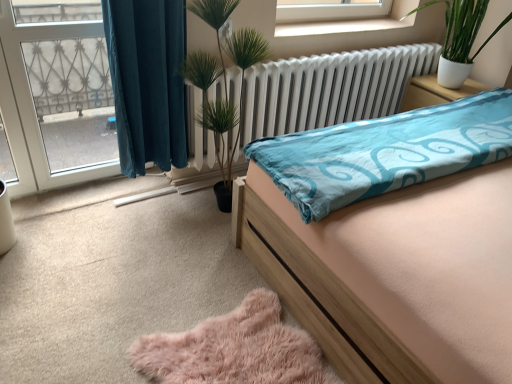
Measure the distance between wooden bed at center and camera.

The distance of wooden bed at center from camera is 3.36 feet.

The width and height of the screenshot is (512, 384). What do you see at coordinates (393, 246) in the screenshot? I see `wooden bed at center` at bounding box center [393, 246].

At what (x,y) coordinates should I click in order to perform the action: click on teal fabric curtain at left. Please return your answer as a coordinate pair (x, y). Looking at the image, I should click on (147, 81).

This screenshot has width=512, height=384. What do you see at coordinates (234, 349) in the screenshot?
I see `fluffy pink rug at lower center` at bounding box center [234, 349].

Image resolution: width=512 pixels, height=384 pixels. What do you see at coordinates (460, 38) in the screenshot?
I see `green glossy plant at upper right` at bounding box center [460, 38].

At what (x,y) coordinates should I click in order to perform the action: click on transparent glass door at left. Please return your answer as a coordinate pair (x, y). Image resolution: width=512 pixels, height=384 pixels. Looking at the image, I should click on (55, 93).

Where is `wooden bed at center`? Image resolution: width=512 pixels, height=384 pixels. wooden bed at center is located at coordinates (393, 246).

Considering the sizes of objects wooden bed at center and teal fabric curtain at left in the image provided, who is thinner, wooden bed at center or teal fabric curtain at left?

With smaller width is teal fabric curtain at left.

Which is more distant, (303, 157) or (146, 92)?

Positioned behind is point (146, 92).

Which is behind, wooden bed at center or teal fabric curtain at left?

Positioned behind is teal fabric curtain at left.

Who is bigger, wooden bed at center or teal fabric curtain at left?

Bigger between the two is wooden bed at center.

How distant is white glossy nightstand at upper right from transparent glass door at left?

A distance of 2.30 meters exists between white glossy nightstand at upper right and transparent glass door at left.

From a real-world perspective, which is physically below, white glossy nightstand at upper right or transparent glass door at left?

white glossy nightstand at upper right is physically lower.

Does white glossy nightstand at upper right have a lesser height compared to transparent glass door at left?

Yes, white glossy nightstand at upper right is shorter than transparent glass door at left.

Looking at this image, would you say white glossy nightstand at upper right is inside or outside transparent glass door at left?

white glossy nightstand at upper right cannot be found inside transparent glass door at left.

From the picture: From a real-world perspective, which is physically below, teal fabric curtain at left or fluffy pink rug at lower center?

fluffy pink rug at lower center.

Considering the sizes of teal fabric curtain at left and fluffy pink rug at lower center in the image, is teal fabric curtain at left bigger or smaller than fluffy pink rug at lower center?

teal fabric curtain at left is bigger than fluffy pink rug at lower center.

From the image's perspective, is teal fabric curtain at left under fluffy pink rug at lower center?

No.

Which object is wider, teal fabric curtain at left or fluffy pink rug at lower center?

Wider between the two is fluffy pink rug at lower center.

Who is bigger, wooden bed at center or white glossy nightstand at upper right?

With larger size is wooden bed at center.

Is point (356, 218) in front of point (472, 87)?

Yes, it is in front of point (472, 87).

How many degrees apart are the facing directions of wooden bed at center and white glossy nightstand at upper right?

The angular difference between wooden bed at center and white glossy nightstand at upper right is 0.554 degrees.

Is fluffy pink rug at lower center aimed at teal fabric curtain at left?

No, fluffy pink rug at lower center is not oriented towards teal fabric curtain at left.

Looking at this image, which is correct: fluffy pink rug at lower center is inside teal fabric curtain at left, or outside of it?

fluffy pink rug at lower center exists outside the volume of teal fabric curtain at left.

Identify the location of curtain above the fluffy pink rug at lower center (from the image's perspective). Image resolution: width=512 pixels, height=384 pixels. (147, 81).

Is teal fabric curtain at left directly adjacent to white metallic radiator at center?

teal fabric curtain at left is not next to white metallic radiator at center, and they're not touching.

The height and width of the screenshot is (384, 512). In order to click on radiator below the teal fabric curtain at left (from a real-world perspective) in this screenshot , I will do `click(329, 89)`.

From a real-world perspective, is teal fabric curtain at left located beneath white metallic radiator at center?

Actually, teal fabric curtain at left is physically above white metallic radiator at center in the real world.

Can you confirm if white metallic radiator at center is thinner than white glossy nightstand at upper right?

No, white metallic radiator at center is not thinner than white glossy nightstand at upper right.

In the scene shown: Is white metallic radiator at center inside the boundaries of white glossy nightstand at upper right, or outside?

white metallic radiator at center is not enclosed by white glossy nightstand at upper right.

Can you confirm if white metallic radiator at center is taller than white glossy nightstand at upper right?

Yes.

Locate an element on the screen. bed in front of the teal fabric curtain at left is located at coordinates (393, 246).

Where is `glass door on the left of white glossy nightstand at upper right`? The image size is (512, 384). glass door on the left of white glossy nightstand at upper right is located at coordinates click(x=55, y=93).

From the image, which object appears to be farther from wooden bed at center, fluffy pink rug at lower center or teal fabric curtain at left?

The object further to wooden bed at center is teal fabric curtain at left.

Looking at this image, looking at the image, which one is located further to fluffy pink rug at lower center, green glossy plant at upper right or transparent glass door at left?

Based on the image, green glossy plant at upper right appears to be further to fluffy pink rug at lower center.

From the image, which object appears to be nearer to green glossy plant at upper right, teal fabric curtain at left or white glossy nightstand at upper right?

white glossy nightstand at upper right is positioned closer to the anchor green glossy plant at upper right.

Estimate the real-world distances between objects in this image. Which object is closer to green glossy plant at upper right, fluffy pink rug at lower center or wooden bed at center?

Among the two, wooden bed at center is located nearer to green glossy plant at upper right.

Estimate the real-world distances between objects in this image. Which object is further from fluffy pink rug at lower center, wooden bed at center or green glossy plant at upper right?

green glossy plant at upper right lies further to fluffy pink rug at lower center than the other object.

When comparing their distances from white glossy nightstand at upper right, does white metallic radiator at center or wooden bed at center seem closer?

The object closer to white glossy nightstand at upper right is white metallic radiator at center.

Looking at the image, which one is located further to white metallic radiator at center, white glossy nightstand at upper right or teal fabric curtain at left?

white glossy nightstand at upper right.

Consider the image. Which object lies nearer to the anchor point white metallic radiator at center, white glossy nightstand at upper right or wooden bed at center?

The object closer to white metallic radiator at center is white glossy nightstand at upper right.

At what (x,y) coordinates should I click in order to perform the action: click on bed between transparent glass door at left and green glossy plant at upper right. Please return your answer as a coordinate pair (x, y). This screenshot has width=512, height=384. Looking at the image, I should click on (393, 246).

Where is `plain between transparent glass door at left and white metallic radiator at center from left to right`? This screenshot has width=512, height=384. plain between transparent glass door at left and white metallic radiator at center from left to right is located at coordinates (234, 349).

The height and width of the screenshot is (384, 512). I want to click on curtain located between transparent glass door at left and white glossy nightstand at upper right in the left-right direction, so click(x=147, y=81).

Where is `plain positioned between wooden bed at center and white metallic radiator at center from near to far`? plain positioned between wooden bed at center and white metallic radiator at center from near to far is located at coordinates (234, 349).